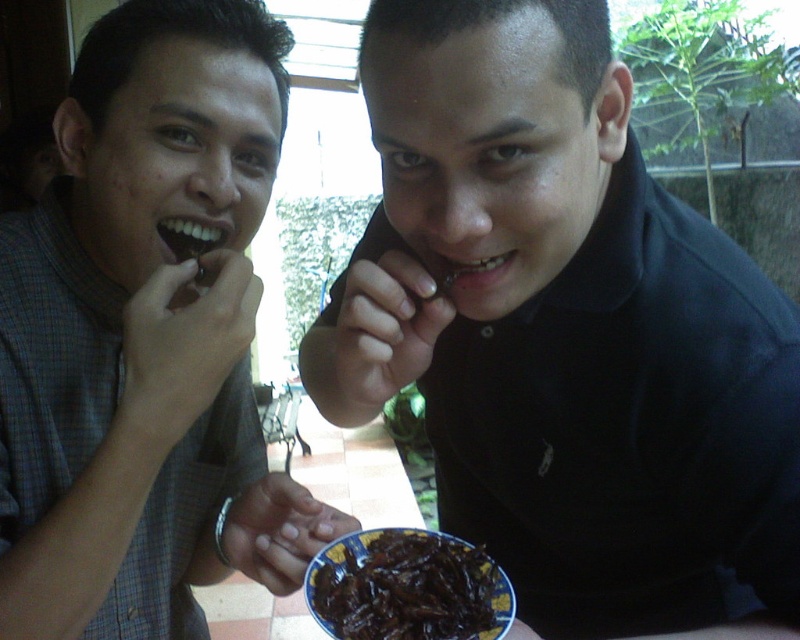
Question: Does black matte shirt at center have a greater width compared to dark glossy insects at center?

Choices:
 (A) no
 (B) yes

Answer: (B)

Question: Considering the relative positions of matte black shirt at left and dark glossy insects at center in the image provided, where is matte black shirt at left located with respect to dark glossy insects at center?

Choices:
 (A) below
 (B) above

Answer: (B)

Question: Which of the following is the farthest from the observer?

Choices:
 (A) black matte shirt at center
 (B) dark glossy insects at center

Answer: (B)

Question: Is matte black shirt at left further to camera compared to dark glossy insects at center?

Choices:
 (A) no
 (B) yes

Answer: (A)

Question: Among these points, which one is farthest from the camera?

Choices:
 (A) (332, 586)
 (B) (502, 536)

Answer: (B)

Question: Which object is the closest to the dark glossy insects at center?

Choices:
 (A) matte black shirt at left
 (B) black matte shirt at center

Answer: (B)